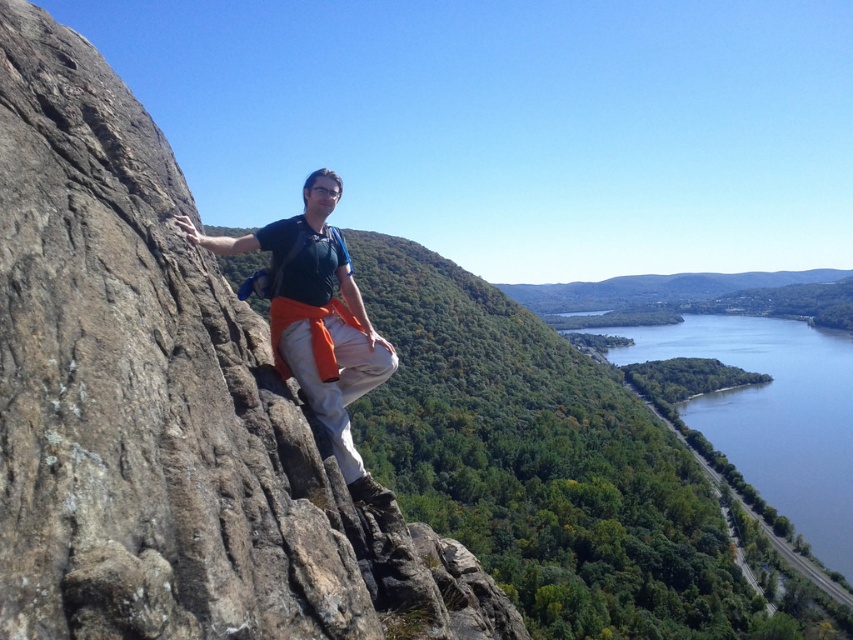
Question: Is blue glassy water at lower right smaller than matte black shirt at center?

Choices:
 (A) yes
 (B) no

Answer: (B)

Question: Which object appears closest to the camera in this image?

Choices:
 (A) blue glassy water at lower right
 (B) matte black shirt at center

Answer: (B)

Question: Is blue glassy water at lower right positioned at the back of matte black shirt at center?

Choices:
 (A) yes
 (B) no

Answer: (A)

Question: Is blue glassy water at lower right wider than matte black shirt at center?

Choices:
 (A) no
 (B) yes

Answer: (B)